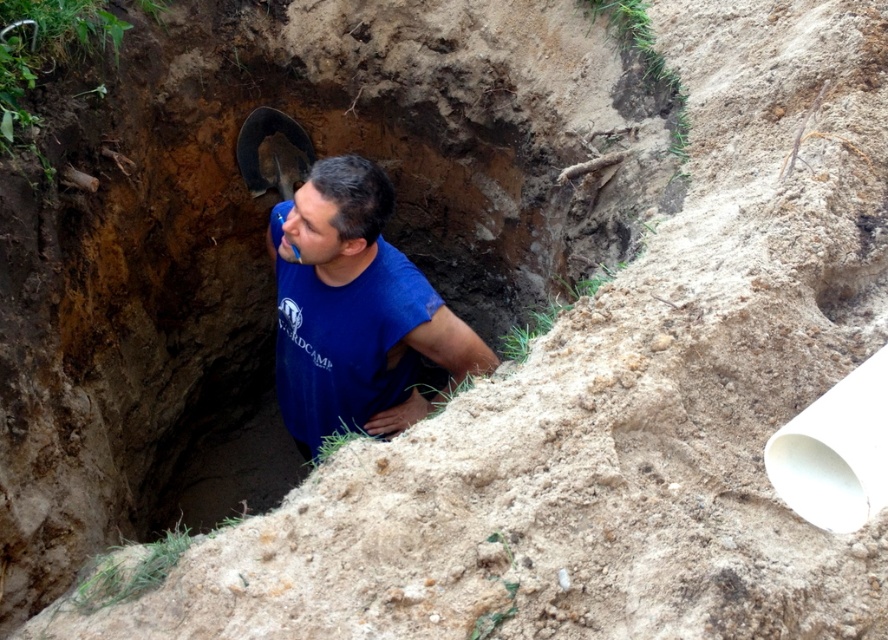
Is point (322, 216) farther from viewer compared to point (242, 508)?

No.

Does blue cotton shirt at center appear on the right side of brown dirt hole at center?

Correct, you'll find blue cotton shirt at center to the right of brown dirt hole at center.

Where is `blue cotton shirt at center`? This screenshot has width=888, height=640. blue cotton shirt at center is located at coordinates (355, 310).